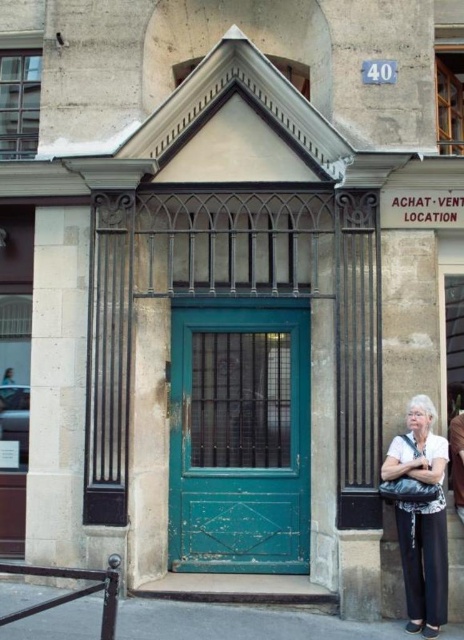
You are a painter who wants to paint both the green wooden door at center and the white fabric at center. Which object requires more paint due to its size?

The green wooden door at center requires more paint because it is bigger than the white fabric at center.

You are standing in front of the building and notice the green wooden door at center and the white fabric at center. Which object is located to the right of the other?

The green wooden door at center is positioned on the left side of white fabric at center, so the white fabric at center is to the right of the green wooden door at center.